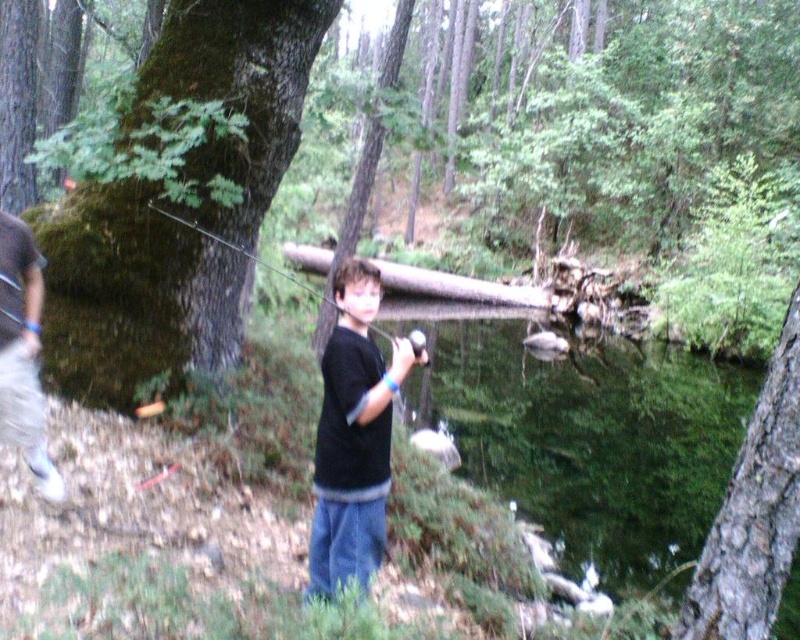
Who is more forward, (590,394) or (398,280)?

Point (590,394)

Consider the image. Who is taller, green reflective water at center or brown wood log at center?

green reflective water at center

Identify the location of green reflective water at center. (584, 433).

Identify the location of green mossy tree at left. (132, 294).

Is point (168, 276) positioned before point (392, 392)?

No, it is not.

Is point (154, 308) more distant than point (346, 532)?

Yes, it is behind point (346, 532).

The height and width of the screenshot is (640, 800). I want to click on green mossy tree at left, so click(x=132, y=294).

Measure the distance between brown rough bark tree at right and camera.

A distance of 2.35 meters exists between brown rough bark tree at right and camera.

Is point (786, 529) less distant than point (20, 307)?

Yes.

Identify the location of brown rough bark tree at right. (754, 513).